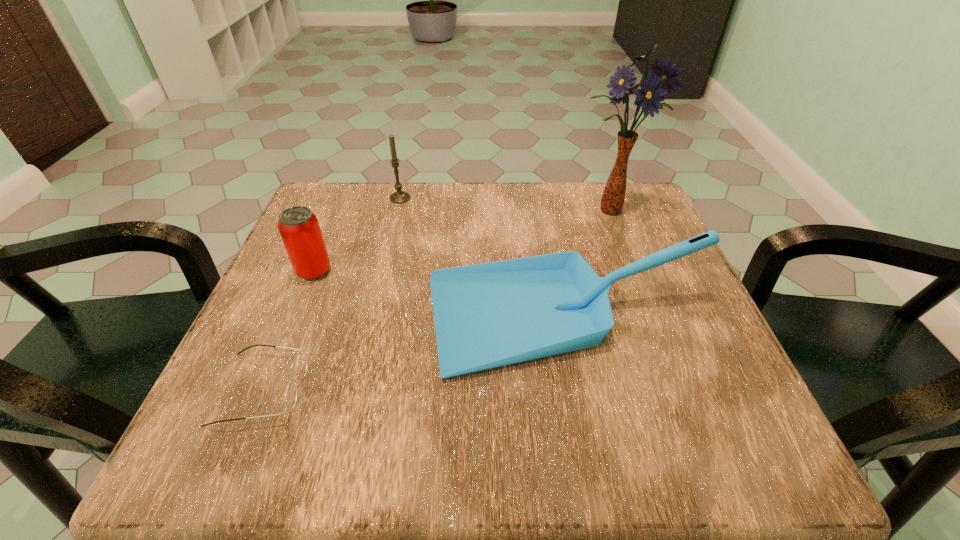
Where is `vacant space that is in between the candle and the tallest object`? This screenshot has width=960, height=540. vacant space that is in between the candle and the tallest object is located at coordinates (505, 205).

The width and height of the screenshot is (960, 540). Identify the location of empty space that is in between the candle and the dustpan. (483, 259).

At what (x,y) coordinates should I click in order to perform the action: click on vacant space in between the tallest object and the candle. Please return your answer as a coordinate pair (x, y). Looking at the image, I should click on (505, 205).

Select which object is the fourth closest to the dustpan. Please provide its 2D coordinates. Your answer should be formatted as a tuple, i.e. [(x, y)], where the tuple contains the x and y coordinates of a point satisfying the conditions above.

[(399, 196)]

This screenshot has width=960, height=540. Identify the location of object that stands as the fourth closest to the spectacles. (649, 97).

Identify the location of vacant position in the image that satisfies the following two spatial constraints: 1. on the back side of the candle; 2. on the right side of the can. (344, 198).

Find the location of a particular element. The height and width of the screenshot is (540, 960). free location that satisfies the following two spatial constraints: 1. on the front side of the dustpan; 2. through the lenses of the spectacles is located at coordinates (579, 388).

Locate an element on the screen. free region that satisfies the following two spatial constraints: 1. on the front side of the flower arrangement; 2. on the left side of the third object from right to left is located at coordinates (396, 211).